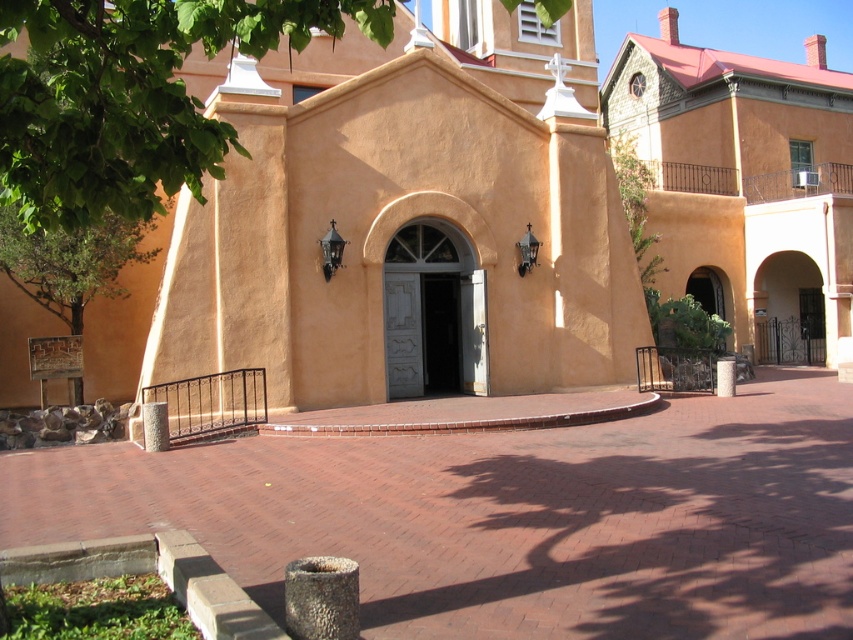
From the picture: You are standing in front of the historic building and want to take a photo of the black matte door at center. Since the matte orange building at center is in the background, will the door be fully visible in the photo?

The matte orange building at center is taller than the black matte door at center, so the door will be fully visible in the photo as the building is behind it.

You are a visitor approaching the entrance of the historic building. You see a white painted wood door at center and a black matte door at center. Which door is more to the left?

The white painted wood door at center is more to the left side of the black matte door at center.